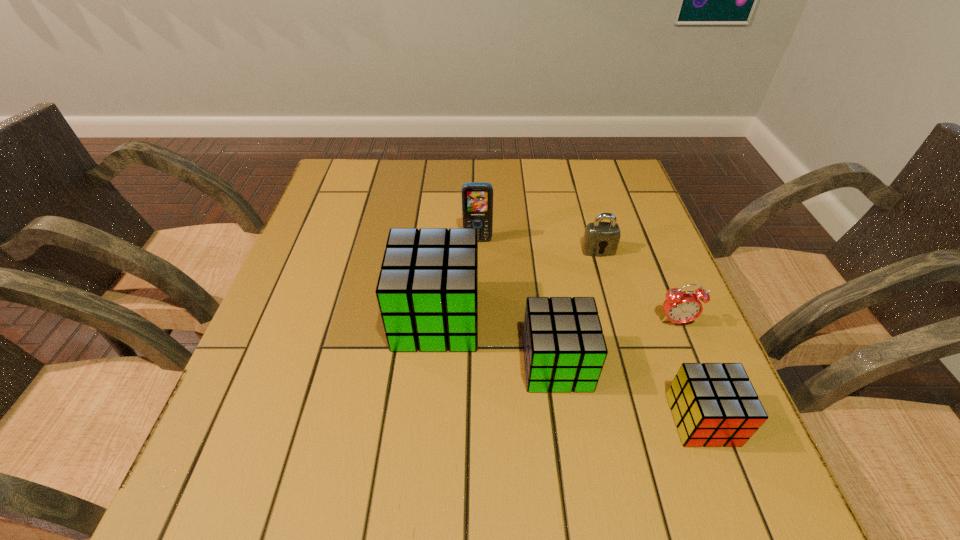
I want to click on free spot located 0.090m on the right of the second cube from right to left, so click(636, 364).

At what (x,y) coordinates should I click in order to perform the action: click on free space located 0.350m on the back of the shortest cube. Please return your answer as a coordinate pair (x, y). Looking at the image, I should click on (642, 262).

This screenshot has width=960, height=540. Identify the location of vacant space located 0.340m on the screen of the farthest object. (477, 357).

Identify the location of free location located at the front of the fifth nearest object near the keyhole. The height and width of the screenshot is (540, 960). (609, 287).

I want to click on free space located on the face of the alarm clock, so click(x=708, y=403).

Identify the location of object that is at the near edge. click(x=713, y=404).

Locate an element on the screen. The image size is (960, 540). cube located at the right edge is located at coordinates (713, 404).

This screenshot has width=960, height=540. I want to click on padlock that is at the right edge, so click(x=601, y=239).

I want to click on alarm clock positioned at the right edge, so click(680, 307).

Locate an element on the screen. object that is at the near right corner is located at coordinates (713, 404).